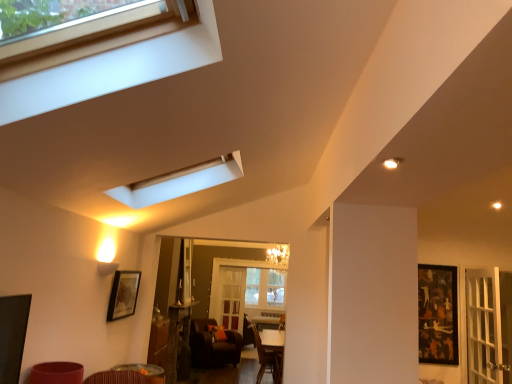
Question: Is wooden frame window at upper left not near matte black picture frame at lower left, placed as the 1th picture frame when sorted from front to back?

Choices:
 (A) yes
 (B) no

Answer: (A)

Question: Would you say wooden frame window at upper left contains matte black picture frame at lower left, acting as the 1th picture frame starting from the left?

Choices:
 (A) yes
 (B) no

Answer: (B)

Question: Is wooden frame window at upper left next to matte black picture frame at lower left, placed as the 2th picture frame when sorted from right to left?

Choices:
 (A) yes
 (B) no

Answer: (B)

Question: Is wooden frame window at upper left at the right side of matte black picture frame at lower left, placed as the 2th picture frame when sorted from right to left?

Choices:
 (A) yes
 (B) no

Answer: (A)

Question: Is wooden frame window at upper left shorter than matte black picture frame at lower left, placed as the 1th picture frame when sorted from front to back?

Choices:
 (A) no
 (B) yes

Answer: (B)

Question: From a real-world perspective, is wooden frame window at upper left on top of matte black picture frame at lower left, placed as the 2th picture frame when sorted from right to left?

Choices:
 (A) yes
 (B) no

Answer: (A)

Question: Is wooden table at center, the 1th table in the back-to-front sequence, surrounded by black glossy picture frame at right, which is the 1th picture frame from back to front?

Choices:
 (A) no
 (B) yes

Answer: (A)

Question: Considering the relative positions of black glossy picture frame at right, which is the 1th picture frame from back to front, and wooden table at center, the 1th table in the back-to-front sequence, in the image provided, is black glossy picture frame at right, which is the 1th picture frame from back to front, to the left of wooden table at center, the 1th table in the back-to-front sequence, from the viewer's perspective?

Choices:
 (A) no
 (B) yes

Answer: (A)

Question: Is black glossy picture frame at right, which ranks as the second picture frame in front-to-back order, taller than wooden table at center, positioned as the second table in top-to-bottom order?

Choices:
 (A) yes
 (B) no

Answer: (B)

Question: Can you confirm if black glossy picture frame at right, arranged as the first picture frame when viewed from the right, is shorter than wooden table at center, placed as the first table when sorted from bottom to top?

Choices:
 (A) yes
 (B) no

Answer: (A)

Question: Considering the relative positions of black glossy picture frame at right, arranged as the first picture frame when viewed from the right, and wooden table at center, placed as the first table when sorted from bottom to top, in the image provided, is black glossy picture frame at right, arranged as the first picture frame when viewed from the right, to the right of wooden table at center, placed as the first table when sorted from bottom to top, from the viewer's perspective?

Choices:
 (A) no
 (B) yes

Answer: (B)

Question: From the image's perspective, is black glossy picture frame at right, which is the 1th picture frame from back to front, under wooden table at center, which is counted as the 2th table, starting from the front?

Choices:
 (A) yes
 (B) no

Answer: (B)

Question: From the image's perspective, is brown leather chair at lower center over matte black picture frame at lower left, placed as the 2th picture frame when sorted from right to left?

Choices:
 (A) no
 (B) yes

Answer: (A)